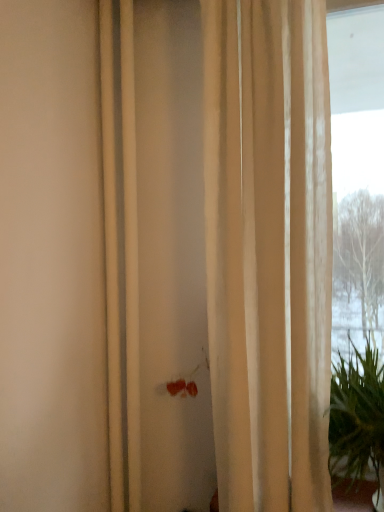
The height and width of the screenshot is (512, 384). Describe the element at coordinates (357, 419) in the screenshot. I see `green leafy plant at right` at that location.

This screenshot has height=512, width=384. What are the coordinates of `green leafy plant at right` in the screenshot? It's located at (357, 419).

This screenshot has height=512, width=384. What do you see at coordinates (217, 251) in the screenshot?
I see `beige sheer curtain at center` at bounding box center [217, 251].

Identify the location of beige sheer curtain at center. This screenshot has width=384, height=512. (217, 251).

Locate an element on the screen. The height and width of the screenshot is (512, 384). green leafy plant at right is located at coordinates (357, 419).

Consider the image. Considering the relative positions of green leafy plant at right and beige sheer curtain at center in the image provided, is green leafy plant at right to the right of beige sheer curtain at center from the viewer's perspective?

Yes, green leafy plant at right is to the right of beige sheer curtain at center.

Is green leafy plant at right further to the viewer compared to beige sheer curtain at center?

No, it is not.

Is point (346, 439) positioned before point (328, 128)?

No.

From the image's perspective, which is below, green leafy plant at right or beige sheer curtain at center?

green leafy plant at right is shown below in the image.

From a real-world perspective, is green leafy plant at right physically located above or below beige sheer curtain at center?

From a real-world perspective, green leafy plant at right is physically below beige sheer curtain at center.

Between green leafy plant at right and beige sheer curtain at center, which one has smaller width?

Thinner between the two is beige sheer curtain at center.

Is green leafy plant at right taller than beige sheer curtain at center?

No.

Does green leafy plant at right have a smaller size compared to beige sheer curtain at center?

Correct, green leafy plant at right occupies less space than beige sheer curtain at center.

Could beige sheer curtain at center be considered to be inside green leafy plant at right?

No, beige sheer curtain at center is not a part of green leafy plant at right.

From the picture: Would you consider green leafy plant at right to be distant from beige sheer curtain at center?

No, green leafy plant at right is not far away from beige sheer curtain at center.

Is green leafy plant at right positioned with its back to beige sheer curtain at center?

No.

Locate an element on the screen. The width and height of the screenshot is (384, 512). houseplant that is on the right side of beige sheer curtain at center is located at coordinates (357, 419).

In the image, is beige sheer curtain at center on the left side or the right side of green leafy plant at right?

From the image, it's evident that beige sheer curtain at center is to the left of green leafy plant at right.

Is the position of beige sheer curtain at center more distant than that of green leafy plant at right?

Yes, it is.

Does point (199, 373) lie behind point (378, 479)?

Yes.

From the image's perspective, is beige sheer curtain at center above or below green leafy plant at right?

beige sheer curtain at center is above green leafy plant at right.

From a real-world perspective, which object stands above the other?

beige sheer curtain at center is physically above.

Which object is thinner, beige sheer curtain at center or green leafy plant at right?

beige sheer curtain at center is thinner.

Consider the image. Considering the relative sizes of beige sheer curtain at center and green leafy plant at right in the image provided, is beige sheer curtain at center shorter than green leafy plant at right?

No.

Is beige sheer curtain at center smaller than green leafy plant at right?

Incorrect, beige sheer curtain at center is not smaller in size than green leafy plant at right.

Is beige sheer curtain at center outside of green leafy plant at right?

beige sheer curtain at center is positioned outside green leafy plant at right.

Does beige sheer curtain at center touch green leafy plant at right?

They are not placed beside each other.

Is beige sheer curtain at center looking in the opposite direction of green leafy plant at right?

beige sheer curtain at center is not turned away from green leafy plant at right.

How different are the orientations of beige sheer curtain at center and green leafy plant at right in degrees?

The facing directions of beige sheer curtain at center and green leafy plant at right are 0.318 degrees apart.

The width and height of the screenshot is (384, 512). What are the coordinates of `curtain on the left side of green leafy plant at right` in the screenshot? It's located at (217, 251).

Find the location of a particular element. houseplant in front of the beige sheer curtain at center is located at coordinates (357, 419).

Find the location of a particular element. The width and height of the screenshot is (384, 512). curtain that is above the green leafy plant at right (from the image's perspective) is located at coordinates (217, 251).